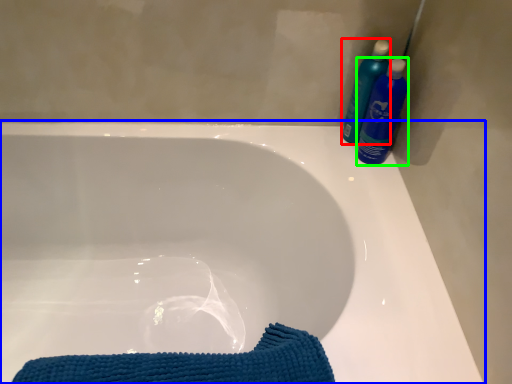
Question: Which object is the closest to the cleaning product (highlighted by a red box)? Choose among these: bathtub (highlighted by a blue box) or cleaning product (highlighted by a green box).

Choices:
 (A) bathtub
 (B) cleaning product

Answer: (B)